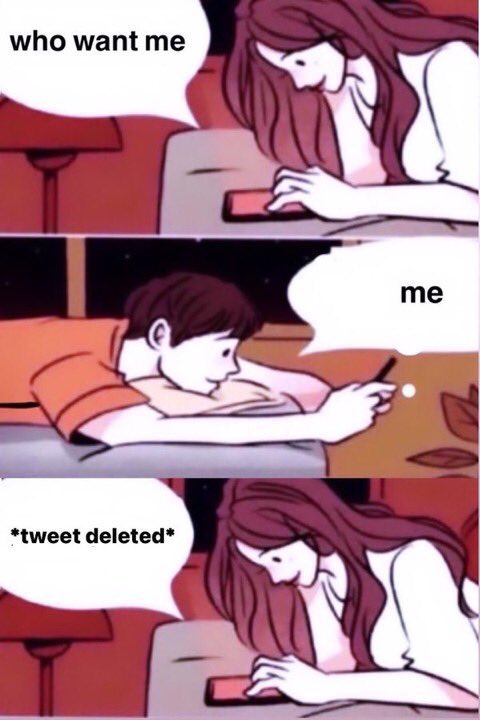
Where is `plant`? The height and width of the screenshot is (720, 480). plant is located at coordinates (469, 418).